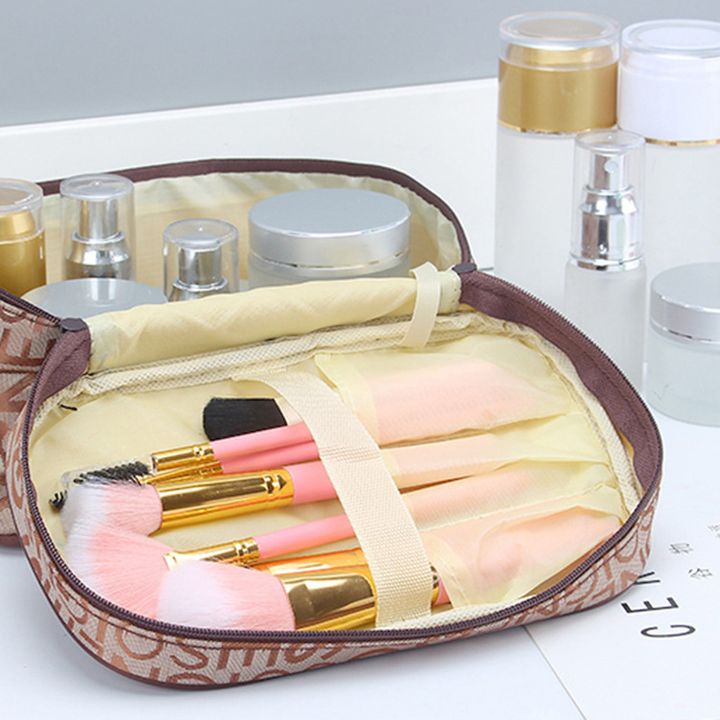
I want to click on containers with clear tops, so click(x=9, y=243), click(x=80, y=232), click(x=180, y=243), click(x=598, y=212), click(x=531, y=39), click(x=659, y=62).